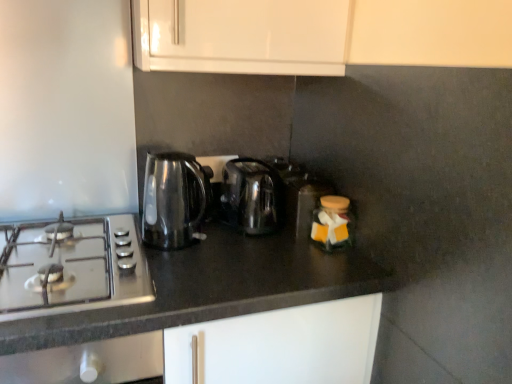
You are a GUI agent. You are given a task and a screenshot of the screen. Output one action in this format:
    pyautogui.click(x=<x>, y=<y>)
    Task: Click on the free space to the left of translucent plastic container at center, positioned as the first appliance in back-to-front order
    
    Given the screenshot: What is the action you would take?
    pyautogui.click(x=234, y=240)